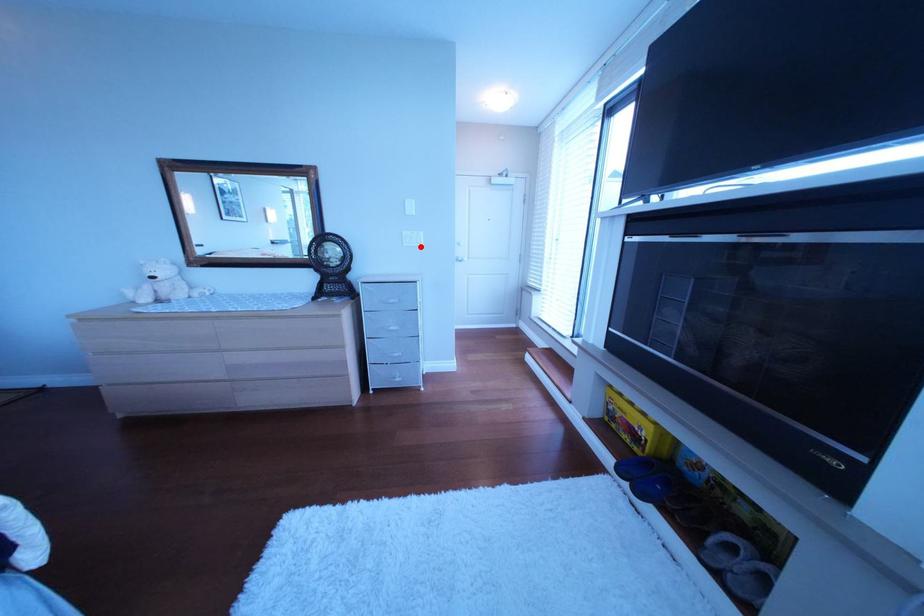
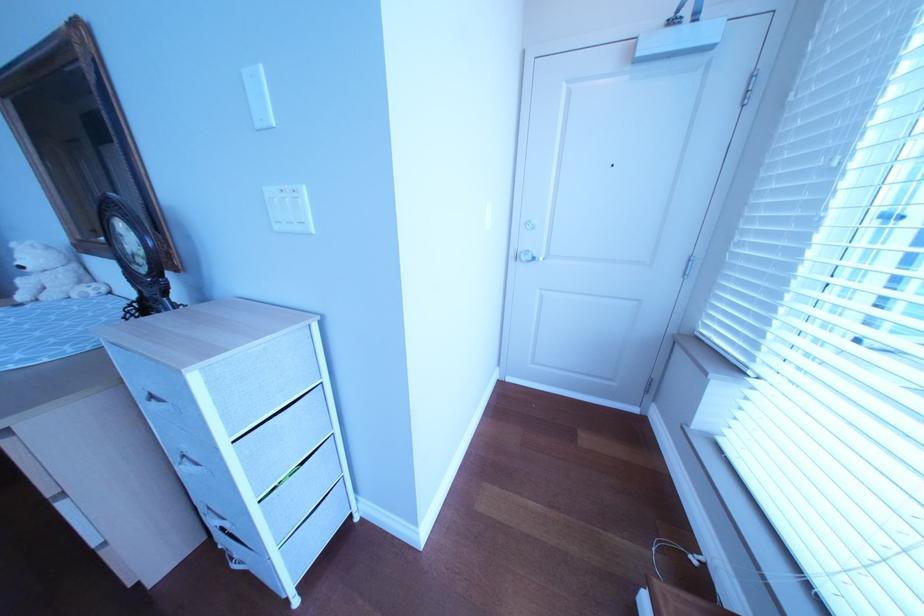
Where in the second image is the point corresponding to the highlighted location from the first image?

(292, 229)